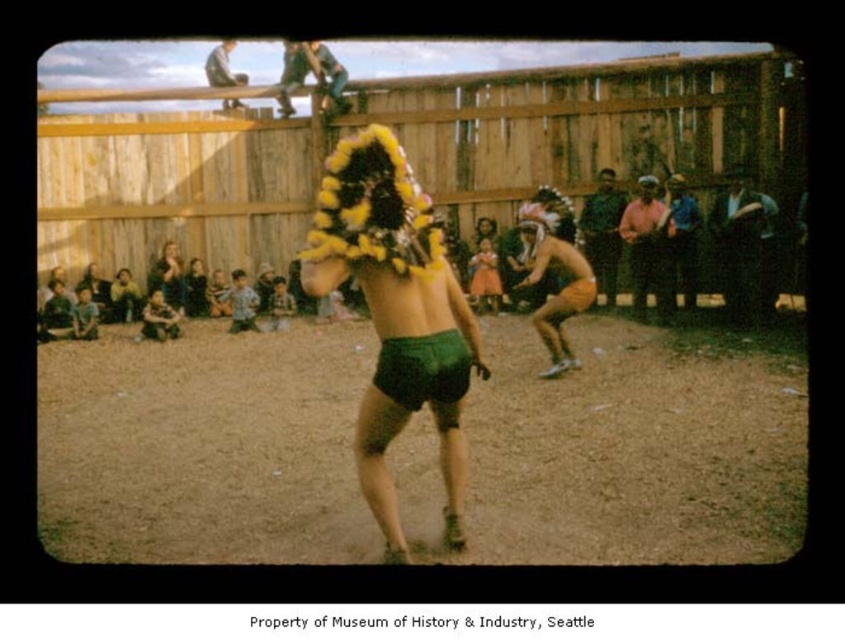
Question: Is dark brown leather jacket at right thinner than matte brown skin at center?

Choices:
 (A) no
 (B) yes

Answer: (B)

Question: Among these objects, which one is farthest from the camera?

Choices:
 (A) matte yellow wig at center
 (B) matte black headdress at upper center
 (C) matte brown skin at center

Answer: (B)

Question: Does dark brown leather jacket at right appear on the left side of shiny metallic helmet at upper center?

Choices:
 (A) yes
 (B) no

Answer: (B)

Question: Which point appears closest to the camera in this image?

Choices:
 (A) (296, 72)
 (B) (653, 211)
 (C) (227, 70)

Answer: (B)

Question: Which of the following is the farthest from the observer?

Choices:
 (A) (320, 81)
 (B) (214, 52)
 (C) (279, 104)
 (D) (598, 202)

Answer: (B)

Question: Considering the relative positions of green matte shorts at center and dark brown leather jacket at right in the image provided, where is green matte shorts at center located with respect to dark brown leather jacket at right?

Choices:
 (A) left
 (B) right

Answer: (A)